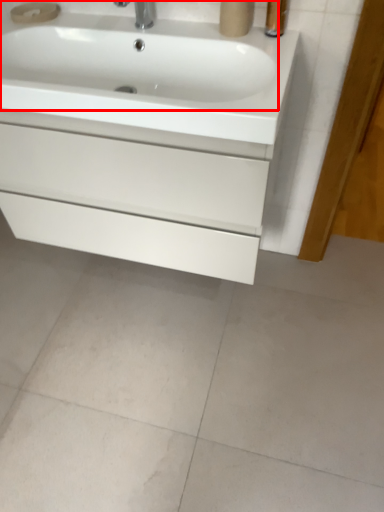
Question: In this image, where is sink (annotated by the red box) located relative to bathroom cabinet?

Choices:
 (A) right
 (B) left

Answer: (B)